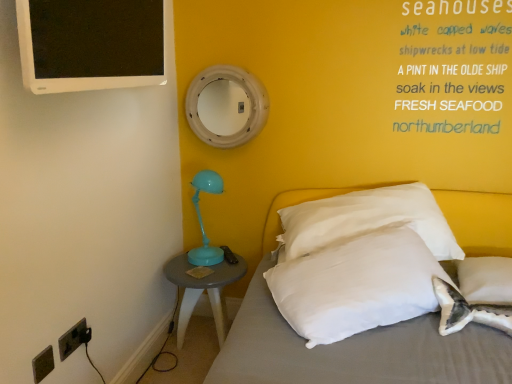
Question: Is white soft pillow at center, the 2th pillow viewed from the right, next to matte gray side table at lower left?

Choices:
 (A) yes
 (B) no

Answer: (B)

Question: Could you tell me if white soft pillow at center, the 2th pillow viewed from the right, is turned towards matte gray side table at lower left?

Choices:
 (A) yes
 (B) no

Answer: (B)

Question: Can you confirm if white soft pillow at center, the 2th pillow viewed from the right, is positioned to the left of matte gray side table at lower left?

Choices:
 (A) no
 (B) yes

Answer: (A)

Question: Is matte gray side table at lower left located within white soft pillow at center, the first pillow viewed from the left?

Choices:
 (A) no
 (B) yes

Answer: (A)

Question: Does white soft pillow at center, the first pillow viewed from the left, have a larger size compared to matte gray side table at lower left?

Choices:
 (A) yes
 (B) no

Answer: (A)

Question: Does point (61, 340) appear closer or farther from the camera than point (34, 92)?

Choices:
 (A) farther
 (B) closer

Answer: (A)

Question: Choose the correct answer: Is black plastic electrical outlet at lower left, placed as the 2th electric outlet when sorted from front to back, inside white glossy computer monitor at upper left or outside it?

Choices:
 (A) inside
 (B) outside

Answer: (B)

Question: In the image, is black plastic electrical outlet at lower left, positioned as the 1th electric outlet in back-to-front order, positioned in front of or behind white glossy computer monitor at upper left?

Choices:
 (A) front
 (B) behind

Answer: (B)

Question: In the image, is black plastic electrical outlet at lower left, placed as the 2th electric outlet when sorted from front to back, on the left side or the right side of white glossy computer monitor at upper left?

Choices:
 (A) left
 (B) right

Answer: (A)

Question: Is matte gray side table at lower left taller or shorter than black plastic electrical outlet at lower left, positioned as the 1th electric outlet in back-to-front order?

Choices:
 (A) tall
 (B) short

Answer: (A)

Question: From a real-world perspective, is matte gray side table at lower left above or below black plastic electrical outlet at lower left, positioned as the 1th electric outlet in back-to-front order?

Choices:
 (A) below
 (B) above

Answer: (A)

Question: From the image's perspective, relative to black plastic electrical outlet at lower left, positioned as the 1th electric outlet in back-to-front order, is matte gray side table at lower left above or below?

Choices:
 (A) above
 (B) below

Answer: (B)

Question: Considering the positions of matte gray side table at lower left and black plastic electrical outlet at lower left, positioned as the 1th electric outlet in back-to-front order, in the image, is matte gray side table at lower left bigger or smaller than black plastic electrical outlet at lower left, positioned as the 1th electric outlet in back-to-front order,?

Choices:
 (A) small
 (B) big

Answer: (B)

Question: Relative to white painted wood mirror at upper center, is white fabric bed at lower right in front or behind?

Choices:
 (A) front
 (B) behind

Answer: (A)

Question: Would you say white fabric bed at lower right is to the left or to the right of white painted wood mirror at upper center in the picture?

Choices:
 (A) right
 (B) left

Answer: (A)